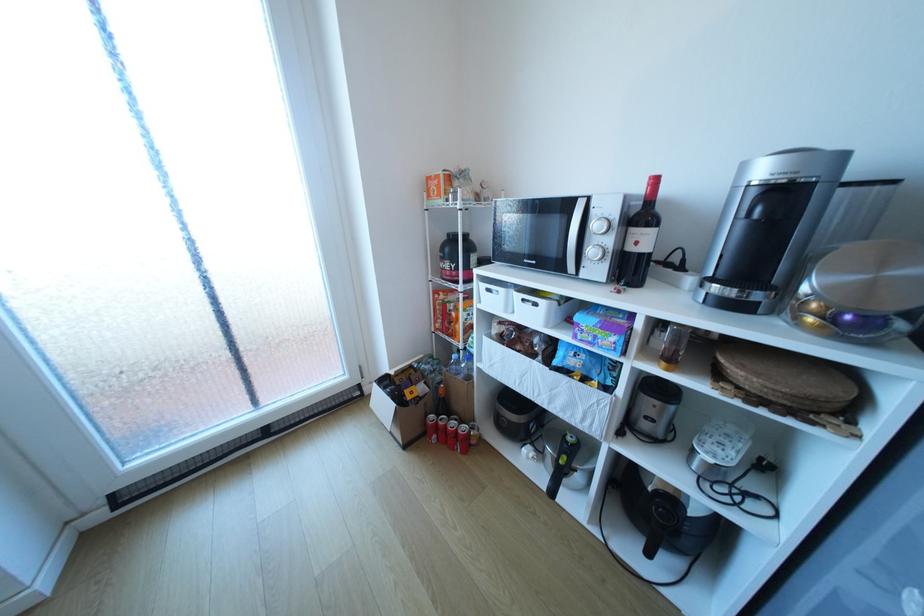
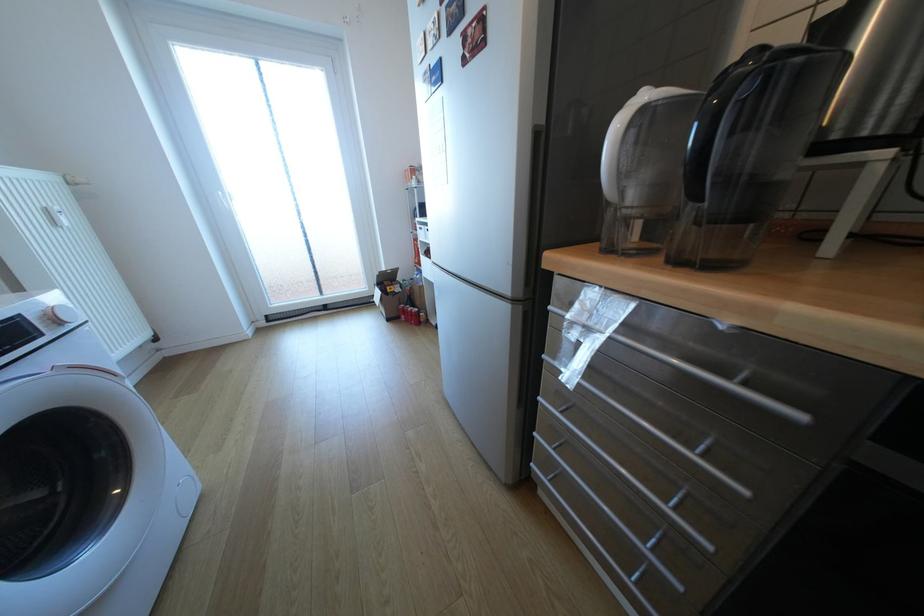
The point at (120, 496) is marked in the first image. Where is the corresponding point in the second image?

(275, 315)